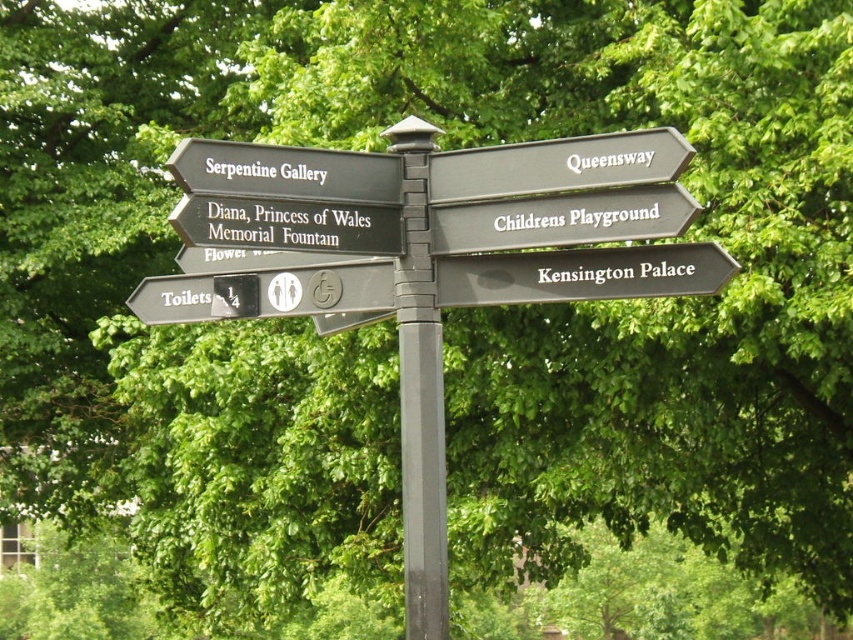
Can you confirm if black plastic sign at upper center is positioned to the left of black metal sign at center?

In fact, black plastic sign at upper center is to the right of black metal sign at center.

Which is more to the right, black plastic sign at upper center or black metal sign at center?

From the viewer's perspective, black plastic sign at upper center appears more on the right side.

The width and height of the screenshot is (853, 640). What do you see at coordinates (556, 164) in the screenshot?
I see `black plastic sign at upper center` at bounding box center [556, 164].

I want to click on black plastic sign at upper center, so click(556, 164).

Is black plastic pole at center bigger than black matte signpost at lower right?

Yes.

Between black plastic pole at center and black matte signpost at lower right, which one is positioned higher?

Positioned higher is black matte signpost at lower right.

Which is behind, point (440, 584) or point (480, 268)?

Point (480, 268)

Where is `black plastic pole at center`? This screenshot has width=853, height=640. black plastic pole at center is located at coordinates (421, 392).

In the scene shown: Can you confirm if black matte signpost at lower right is positioned below black matte sign at upper left?

Correct, black matte signpost at lower right is located below black matte sign at upper left.

Does point (567, 298) come in front of point (206, 168)?

No, (567, 298) is further to viewer.

Image resolution: width=853 pixels, height=640 pixels. Describe the element at coordinates (582, 275) in the screenshot. I see `black matte signpost at lower right` at that location.

The image size is (853, 640). Find the location of `black matte signpost at lower right`. black matte signpost at lower right is located at coordinates (582, 275).